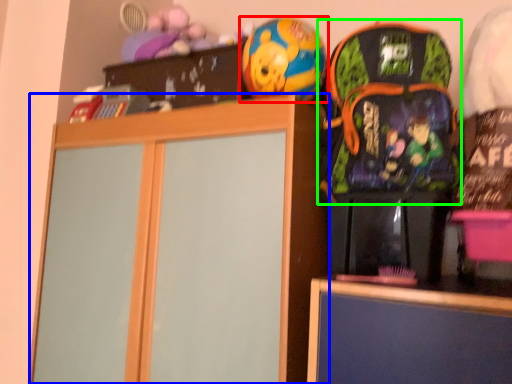
Question: Which object is the farthest from toy (highlighted by a red box)? Choose among these: cabinetry (highlighted by a blue box) or backpack (highlighted by a green box).

Choices:
 (A) cabinetry
 (B) backpack

Answer: (A)